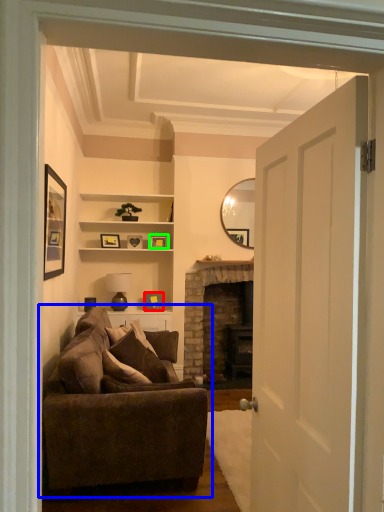
Question: Considering the real-world distances, which object is farthest from picture frame (highlighted by a red box)? studio couch (highlighted by a blue box) or picture frame (highlighted by a green box)?

Choices:
 (A) studio couch
 (B) picture frame

Answer: (A)